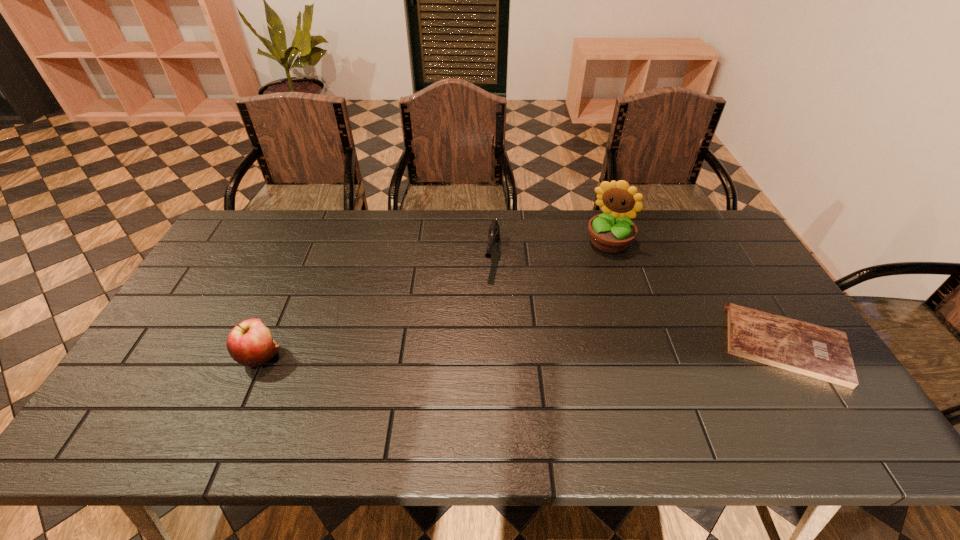
Find the location of a particular element. free space located 0.360m on the face of the second object from right to left is located at coordinates (564, 332).

The image size is (960, 540). In order to click on vacant point located 0.300m at the end of the barrel of the third object from right to left in this screenshot , I will do `click(476, 357)`.

I want to click on vacant space situated 0.320m at the end of the barrel of the third object from right to left, so click(x=475, y=364).

Where is `vacant space situated at the end of the barrel of the third object from right to left`? vacant space situated at the end of the barrel of the third object from right to left is located at coordinates (472, 374).

This screenshot has width=960, height=540. Find the location of `sunflower that is positioned at the far edge`. sunflower that is positioned at the far edge is located at coordinates (611, 232).

I want to click on gun located in the far edge section of the desktop, so click(494, 231).

Find the location of a particular element. This screenshot has width=960, height=540. object situated at the near edge is located at coordinates (815, 351).

The height and width of the screenshot is (540, 960). I want to click on object that is positioned at the right edge, so click(815, 351).

Locate an element on the screen. This screenshot has width=960, height=540. object present at the near right corner is located at coordinates (815, 351).

Identify the location of vacant space at the far edge. (466, 244).